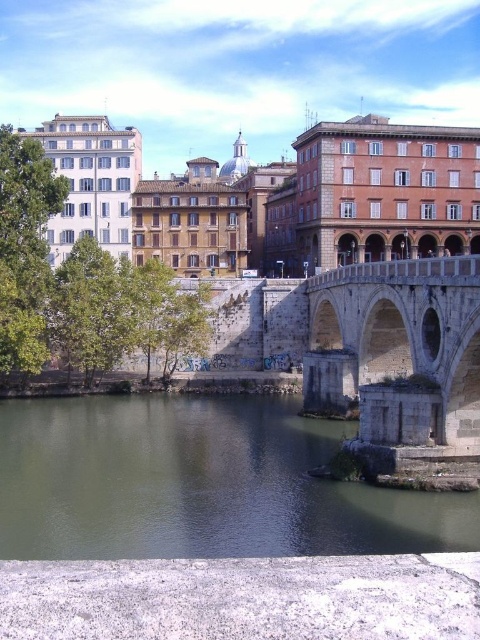
Can you confirm if greenish water at lower left is positioned above stone arch bridge at center?

No.

Is greenish water at lower left closer to the viewer compared to stone arch bridge at center?

That is True.

Who is more forward, (301, 547) or (414, 353)?

Point (301, 547) is more forward.

Find the location of a particular element. greenish water at lower left is located at coordinates (200, 483).